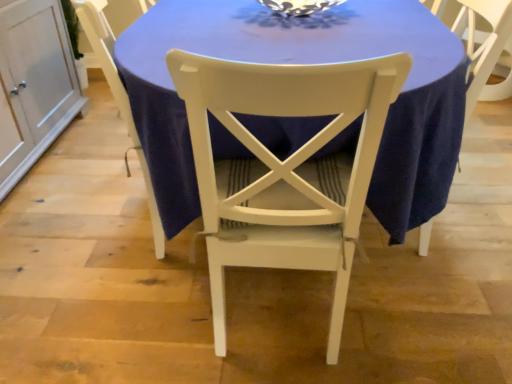
Question: Is blue fabric table at center touching white painted wood chair at center, acting as the 2th chair starting from the right?

Choices:
 (A) no
 (B) yes

Answer: (A)

Question: Is blue fabric table at center smaller than white painted wood chair at center, acting as the 2th chair starting from the right?

Choices:
 (A) yes
 (B) no

Answer: (B)

Question: Can you confirm if blue fabric table at center is taller than white painted wood chair at center, acting as the 2th chair starting from the right?

Choices:
 (A) no
 (B) yes

Answer: (A)

Question: Is blue fabric table at center to the right of white painted wood chair at center, acting as the 2th chair starting from the right, from the viewer's perspective?

Choices:
 (A) yes
 (B) no

Answer: (A)

Question: From the image's perspective, is blue fabric table at center located beneath white painted wood chair at center, acting as the 2th chair starting from the right?

Choices:
 (A) yes
 (B) no

Answer: (B)

Question: From the image's perspective, is white wood cabinet at left above or below blue fabric table at center?

Choices:
 (A) above
 (B) below

Answer: (A)

Question: Considering the positions of white wood cabinet at left and blue fabric table at center in the image, is white wood cabinet at left taller or shorter than blue fabric table at center?

Choices:
 (A) tall
 (B) short

Answer: (B)

Question: In terms of size, does white wood cabinet at left appear bigger or smaller than blue fabric table at center?

Choices:
 (A) big
 (B) small

Answer: (B)

Question: Is point (8, 172) positioned closer to the camera than point (438, 54)?

Choices:
 (A) closer
 (B) farther

Answer: (B)

Question: Is blue fabric table at center to the left or to the right of white painted wood chair at center, acting as the 2th chair starting from the right, in the image?

Choices:
 (A) right
 (B) left

Answer: (A)

Question: Is blue fabric table at center bigger or smaller than white painted wood chair at center, acting as the 2th chair starting from the right?

Choices:
 (A) big
 (B) small

Answer: (A)

Question: Is point (388, 122) positioned closer to the camera than point (156, 208)?

Choices:
 (A) farther
 (B) closer

Answer: (B)

Question: From a real-world perspective, relative to white painted wood chair at center, which is the first chair in left-to-right order, is blue fabric table at center vertically above or below?

Choices:
 (A) below
 (B) above

Answer: (A)

Question: Is point (98, 49) closer or farther from the camera than point (308, 125)?

Choices:
 (A) closer
 (B) farther

Answer: (B)

Question: Choose the correct answer: Is white painted wood chair at center, acting as the 2th chair starting from the right, inside blue fabric table at center or outside it?

Choices:
 (A) outside
 (B) inside

Answer: (B)